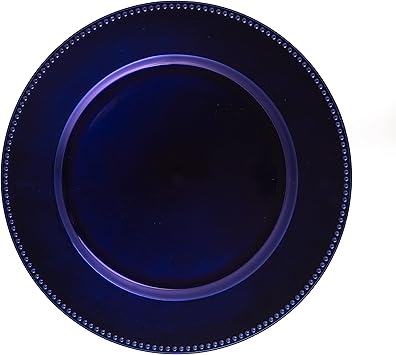
The height and width of the screenshot is (355, 396). I want to click on flat surface portion of charger plate, so click(x=162, y=225).